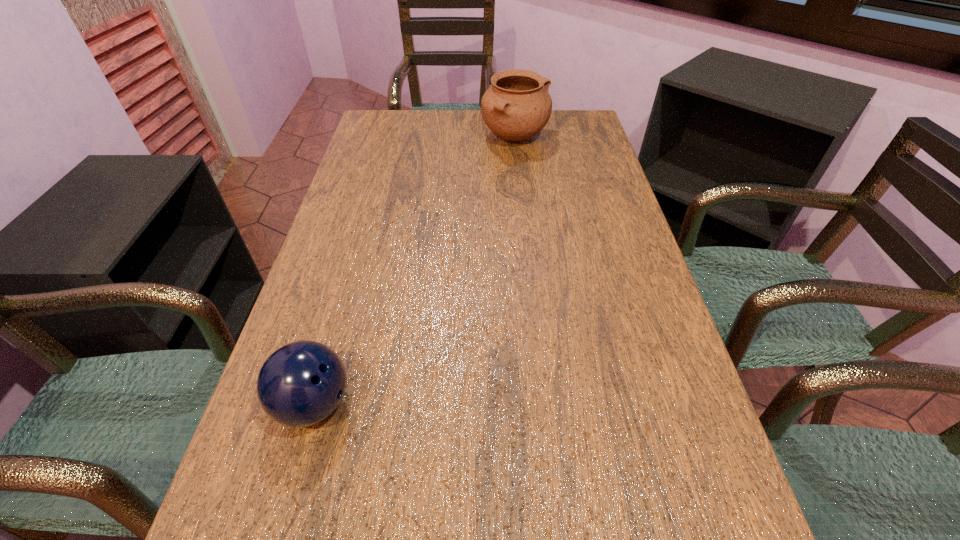
In the image, there is a desktop. At what (x,y) coordinates should I click in order to perform the action: click on free space at the far edge. Please return your answer as a coordinate pair (x, y). This screenshot has width=960, height=540. Looking at the image, I should click on (461, 122).

Locate an element on the screen. The height and width of the screenshot is (540, 960). vacant space at the left edge of the desktop is located at coordinates (371, 146).

What are the coordinates of `free spot at the right edge of the desktop` in the screenshot? It's located at (604, 362).

The width and height of the screenshot is (960, 540). I want to click on vacant region at the far right corner of the desktop, so click(x=579, y=126).

Identify the location of free space that is in between the shorter object and the pottery. This screenshot has height=540, width=960. (415, 271).

You are a GUI agent. You are given a task and a screenshot of the screen. Output one action in this format:
    pyautogui.click(x=<x>, y=<y>)
    Task: Click on the unoccupied position between the pottery and the bowling ball
    The height and width of the screenshot is (540, 960).
    Given the screenshot: What is the action you would take?
    pyautogui.click(x=415, y=271)

What are the coordinates of `vacant space that is in between the left object and the farther object` in the screenshot? It's located at (415, 271).

Locate an element on the screen. The image size is (960, 540). empty space between the left object and the taller object is located at coordinates (415, 271).